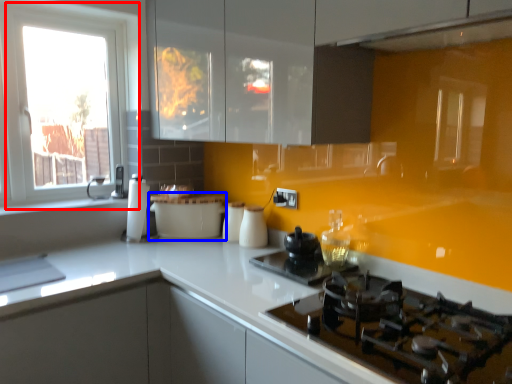
Question: Among these objects, which one is farthest to the camera, window (highlighted by a red box) or kitchen appliance (highlighted by a blue box)?

Choices:
 (A) window
 (B) kitchen appliance

Answer: (B)